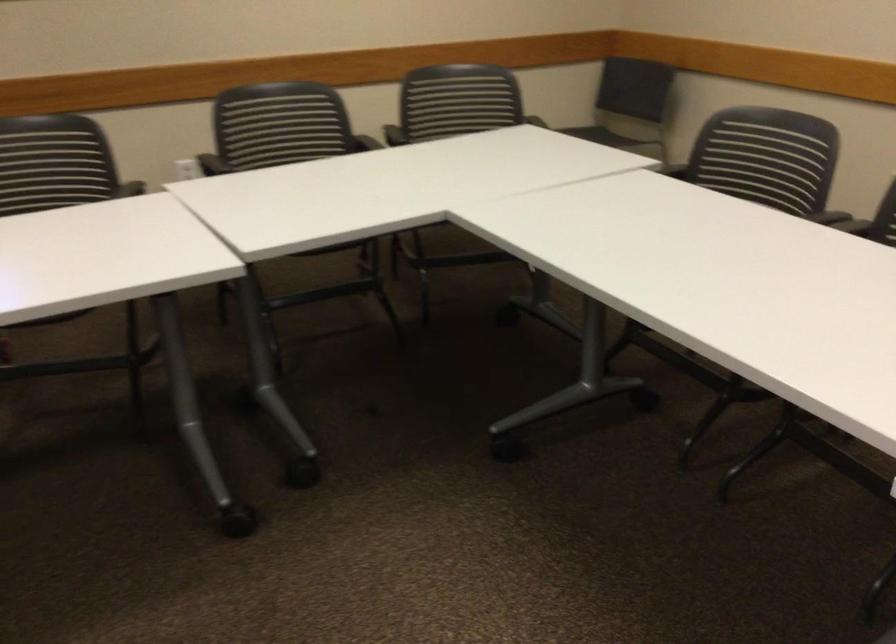
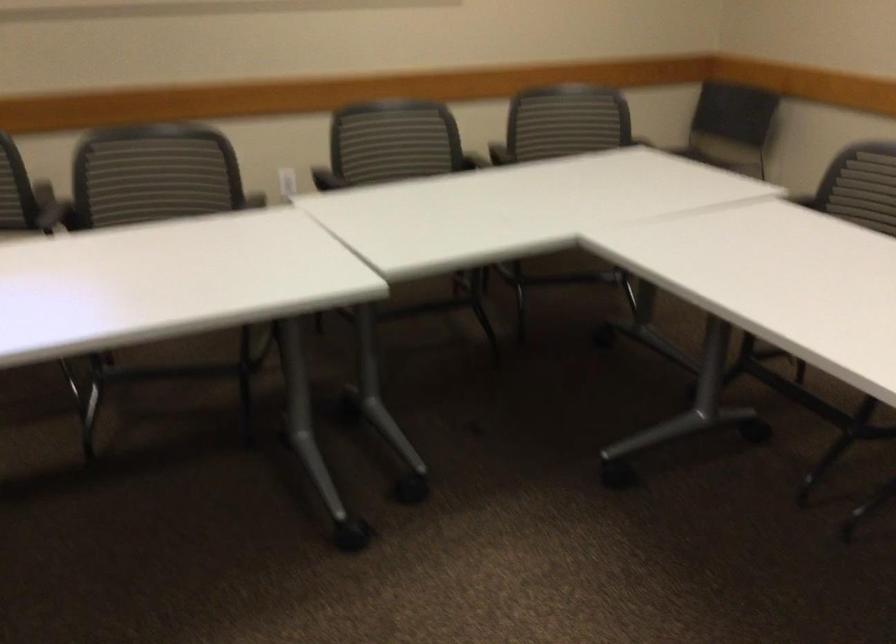
Question: I am providing you with two images of the same scene from different viewpoints. Please identify which objects are invisible in image2.

Choices:
 (A) metal drawer pull
 (B) chair armrest
 (C) chair sitting surface
 (D) black chair sitting surface

Answer: (D)